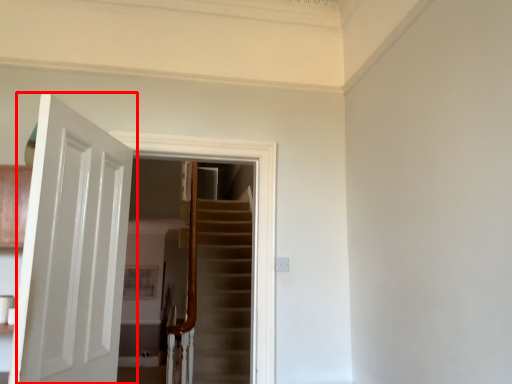
Question: In this image, where is door (annotated by the red box) located relative to screen door?

Choices:
 (A) right
 (B) left

Answer: (B)